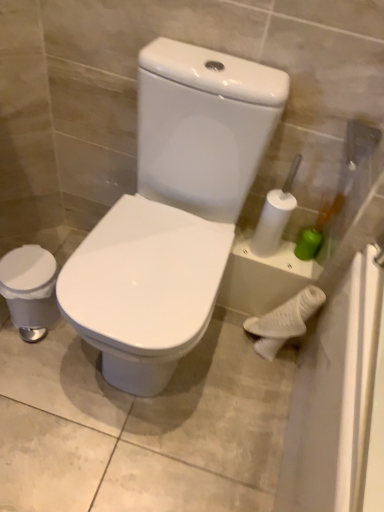
Where is `free spot in front of white glossy trash can at left, arranged as the 3th porcelain when viewed from the right`? This screenshot has height=512, width=384. free spot in front of white glossy trash can at left, arranged as the 3th porcelain when viewed from the right is located at coordinates (31, 366).